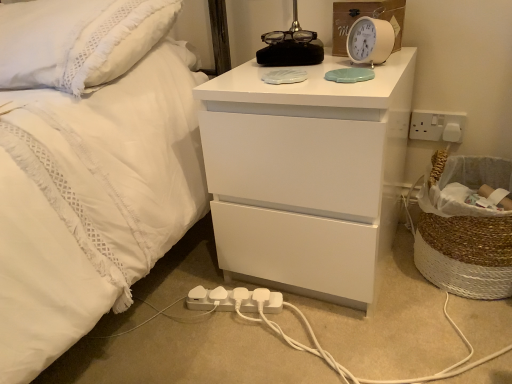
Identify the location of empty space that is in between white glossy chest of drawers at upper center and braided straw laundry basket at right. (416, 301).